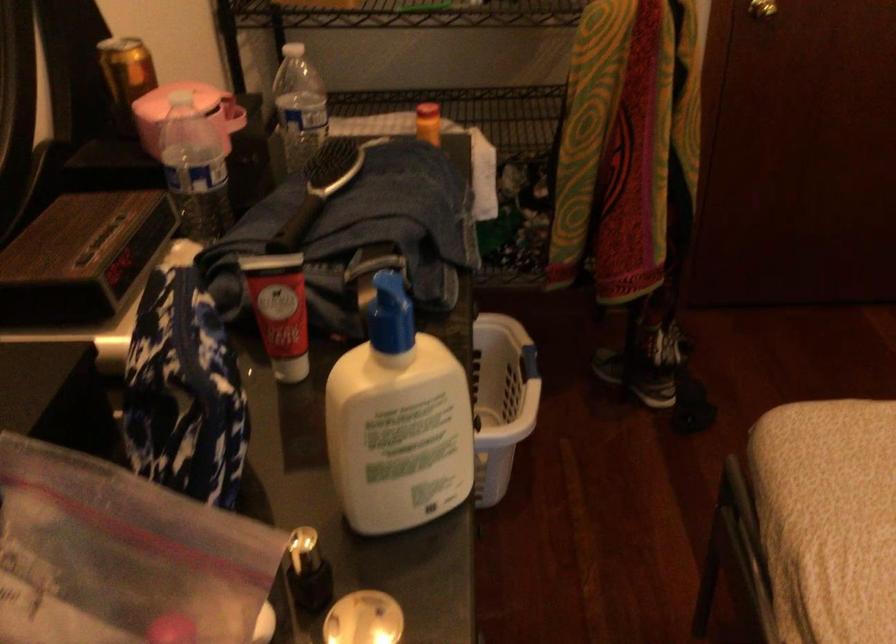
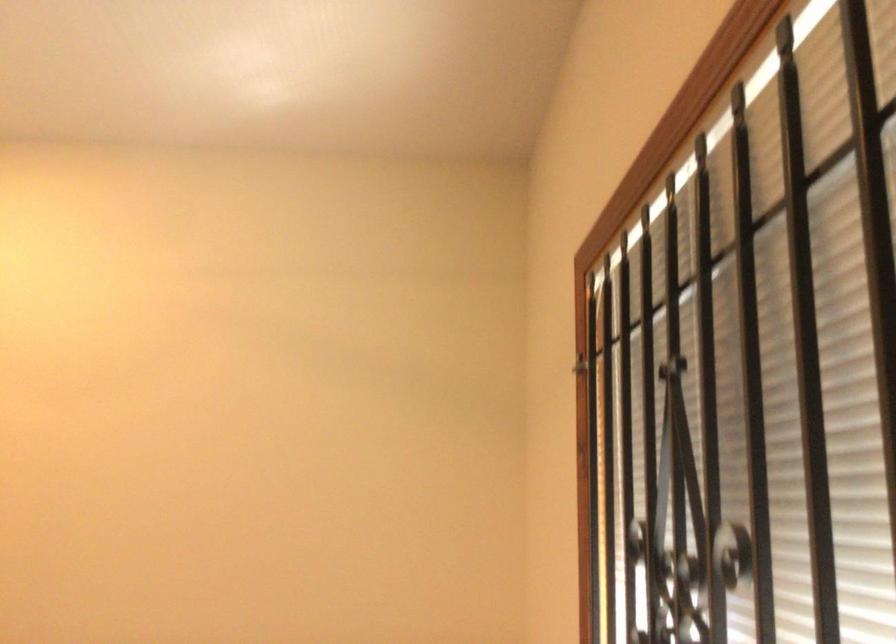
Question: How did the camera likely rotate?

Choices:
 (A) Left
 (B) Right
 (C) Up
 (D) Down

Answer: (B)